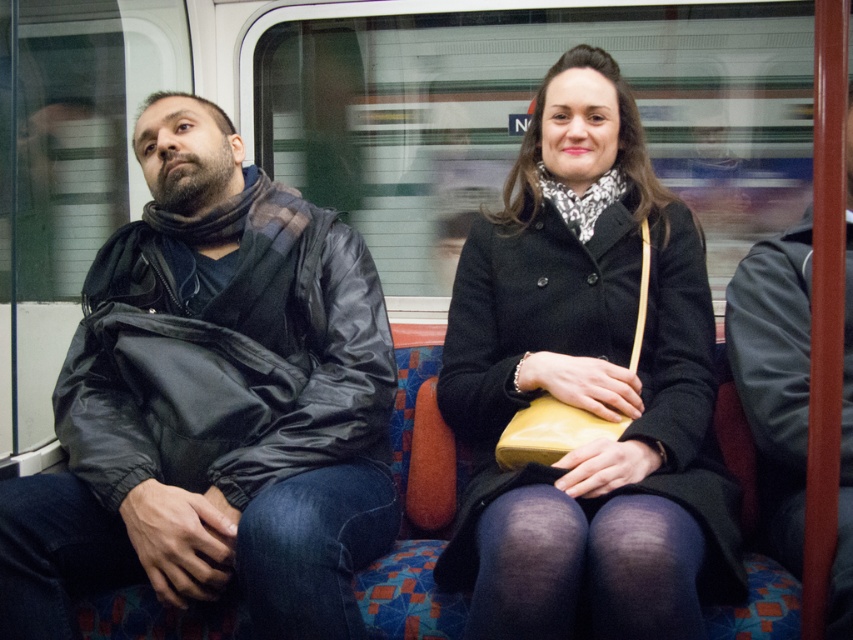
Is black matte coat at center below leather jacket at right?

No, black matte coat at center is not below leather jacket at right.

From the picture: Is black matte coat at center wider than leather jacket at right?

Correct, the width of black matte coat at center exceeds that of leather jacket at right.

Who is more distant from viewer, (666, 412) or (781, 408)?

Positioned behind is point (666, 412).

At what (x,y) coordinates should I click in order to perform the action: click on black matte coat at center. Please return your answer as a coordinate pair (x, y). Looking at the image, I should click on (587, 387).

Is matte black jacket at left bigger than leather jacket at right?

Yes, matte black jacket at left is bigger than leather jacket at right.

Image resolution: width=853 pixels, height=640 pixels. Find the location of `matte black jacket at left`. matte black jacket at left is located at coordinates (213, 404).

What do you see at coordinates (213, 404) in the screenshot? I see `matte black jacket at left` at bounding box center [213, 404].

Image resolution: width=853 pixels, height=640 pixels. Find the location of `matte black jacket at left`. matte black jacket at left is located at coordinates (213, 404).

I want to click on matte black jacket at left, so click(213, 404).